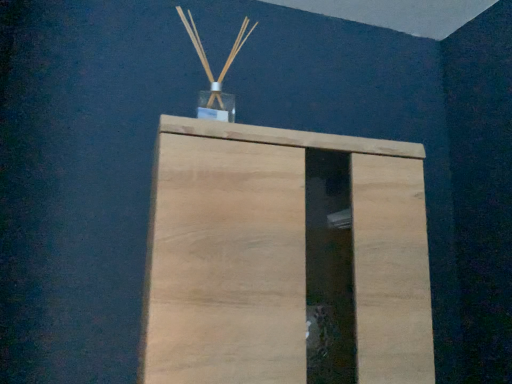
What do you see at coordinates (283, 257) in the screenshot?
I see `natural wood cabinet at center` at bounding box center [283, 257].

At what (x,y) coordinates should I click in order to perform the action: click on natural wood cabinet at center. Please return your answer as a coordinate pair (x, y). This screenshot has width=512, height=384. Looking at the image, I should click on (283, 257).

Locate an element on the screen. The height and width of the screenshot is (384, 512). natural wood cabinet at center is located at coordinates (283, 257).